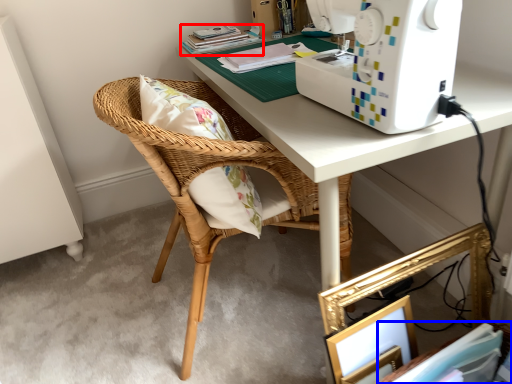
Question: Which of the following is the closest to the observer, book (highlighted by a red box) or book (highlighted by a blue box)?

Choices:
 (A) book
 (B) book

Answer: (B)